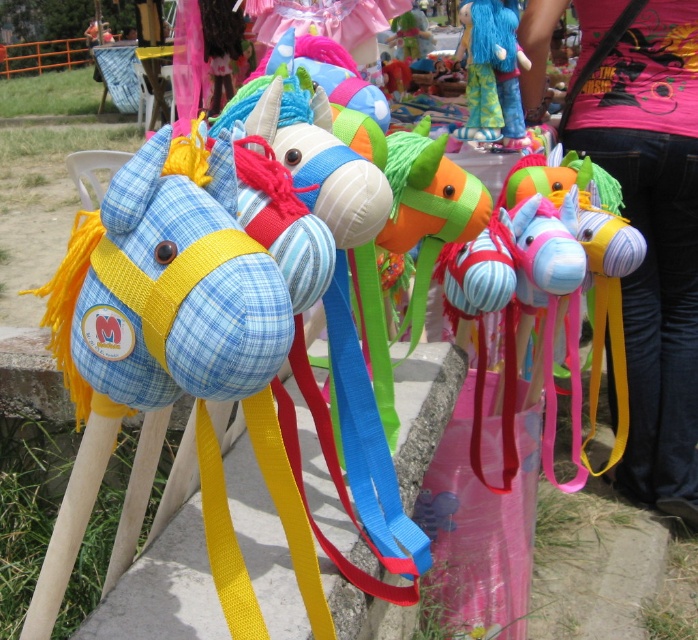
Is point (634, 48) positioned before point (503, 28)?

Yes, point (634, 48) is closer to viewer.

The image size is (698, 640). In order to click on matte pink shirt at upper right in this screenshot , I will do `click(641, 211)`.

Find the location of a particular element. This screenshot has height=640, width=698. matte pink shirt at upper right is located at coordinates (641, 211).